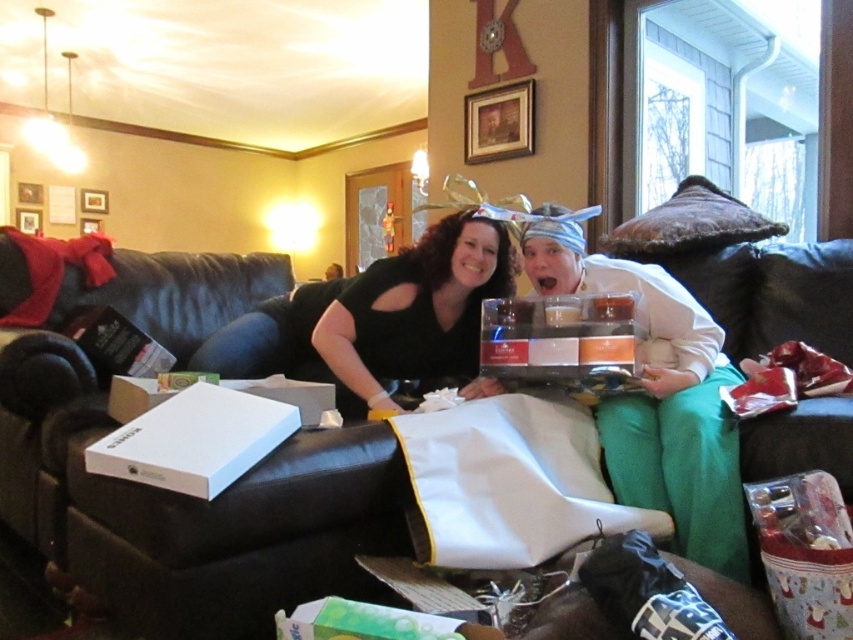
Question: Is black leather couch at center closer to camera compared to matte white tray at center?

Choices:
 (A) yes
 (B) no

Answer: (A)

Question: Among these objects, which one is nearest to the camera?

Choices:
 (A) black matte shirt at center
 (B) matte white tray at center
 (C) black leather couch at center

Answer: (C)

Question: Is black leather couch at center below matte white tray at center?

Choices:
 (A) no
 (B) yes

Answer: (B)

Question: Which point is farther from the camera taking this photo?

Choices:
 (A) (346, 314)
 (B) (612, 484)
 (C) (201, 536)

Answer: (A)

Question: Among these objects, which one is farthest from the camera?

Choices:
 (A) black matte shirt at center
 (B) matte white tray at center
 (C) black leather couch at center

Answer: (A)

Question: Is matte white tray at center closer to camera compared to black matte shirt at center?

Choices:
 (A) no
 (B) yes

Answer: (B)